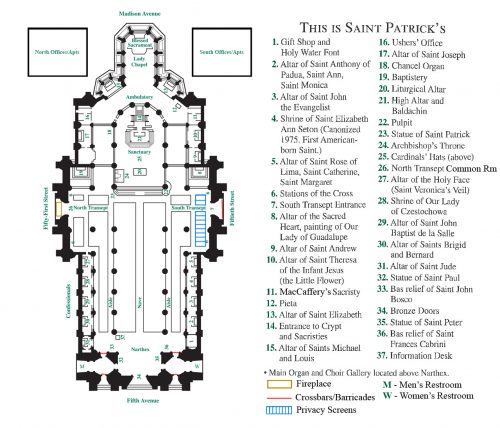
Identify the location of entrances. click(162, 117).